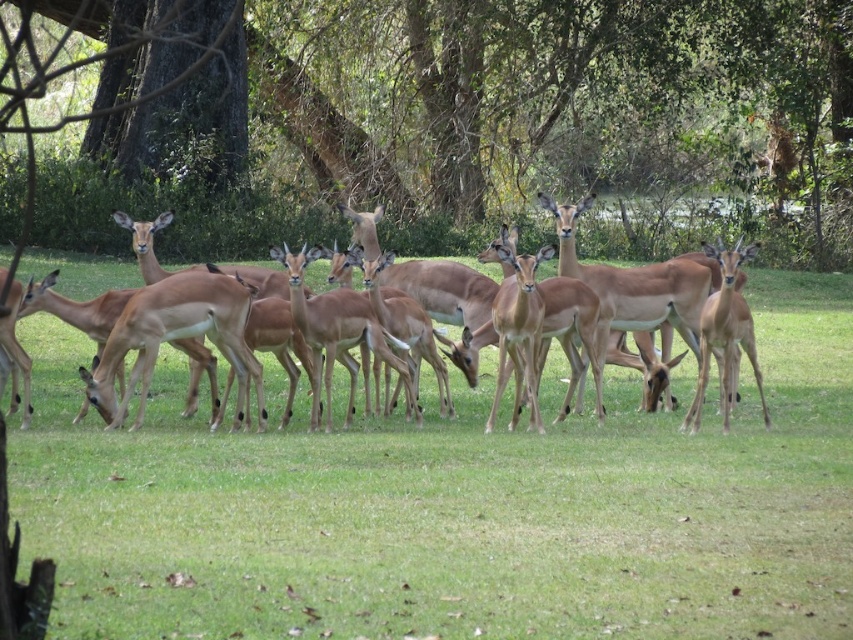
Consider the image. How far apart are brown wood tree at upper center and light brown antelope at center?

A distance of 64.35 feet exists between brown wood tree at upper center and light brown antelope at center.

Is point (314, 164) positioned behind point (10, 400)?

Yes, it is.

Describe the element at coordinates (570, 106) in the screenshot. I see `brown wood tree at upper center` at that location.

At what (x,y) coordinates should I click in order to perform the action: click on brown wood tree at upper center. Please return your answer as a coordinate pair (x, y). Looking at the image, I should click on [x=570, y=106].

In the scene shown: Is brown wood tree at upper center shorter than brown matte/deer at center?

No, brown wood tree at upper center is not shorter than brown matte/deer at center.

Which of these two, brown wood tree at upper center or brown matte/deer at center, stands shorter?

With less height is brown matte/deer at center.

You are a GUI agent. You are given a task and a screenshot of the screen. Output one action in this format:
    pyautogui.click(x=<x>, y=<y>)
    Task: Click on the brown wood tree at upper center
    The width and height of the screenshot is (853, 640).
    Given the screenshot: What is the action you would take?
    pyautogui.click(x=570, y=106)

Which is above, brown smooth antelope at center or brown wood tree at upper center?

brown wood tree at upper center

Which of these two, brown smooth antelope at center or brown wood tree at upper center, stands taller?

Standing taller between the two is brown wood tree at upper center.

Locate an element on the screen. brown smooth antelope at center is located at coordinates (457, 504).